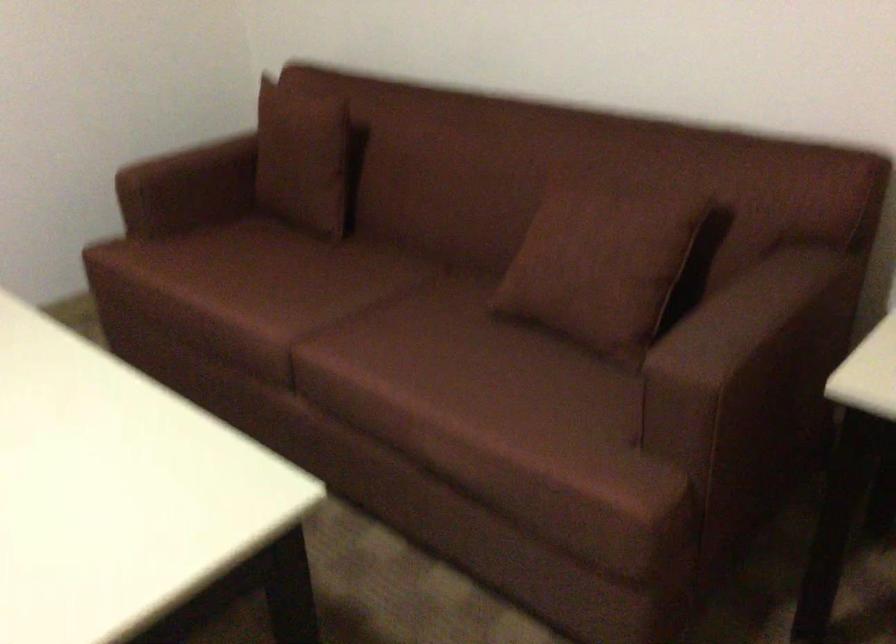
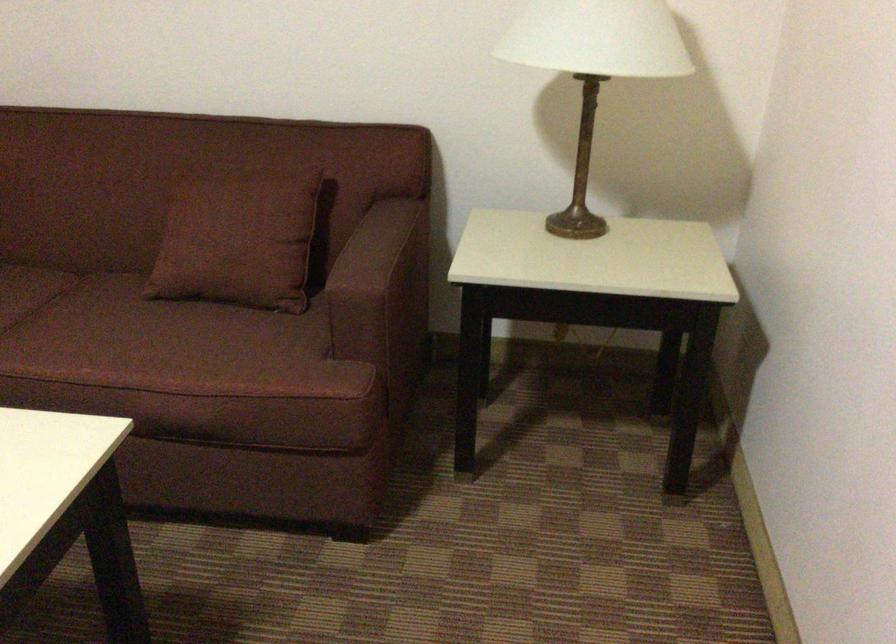
Find the pixel in the second image that matches (589,263) in the first image.

(238, 234)